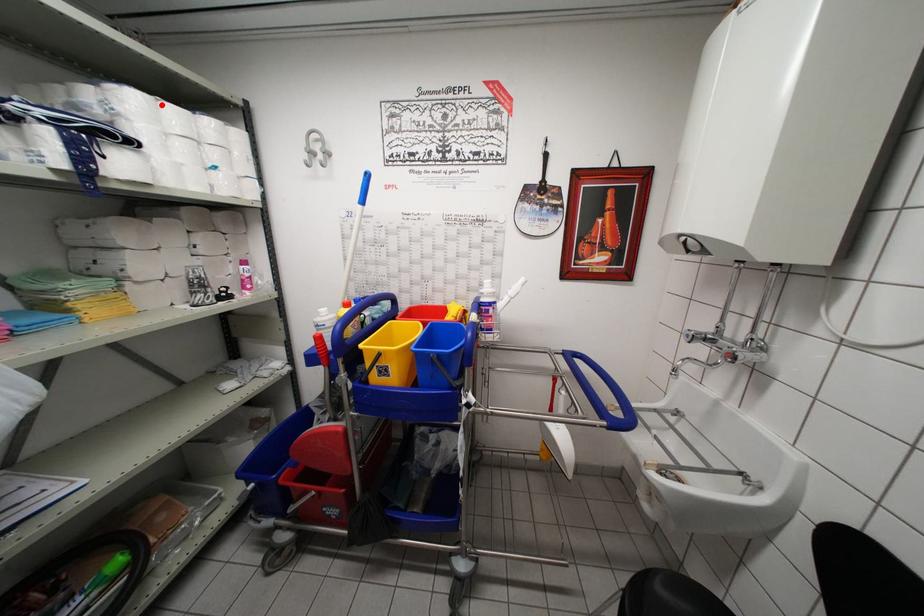
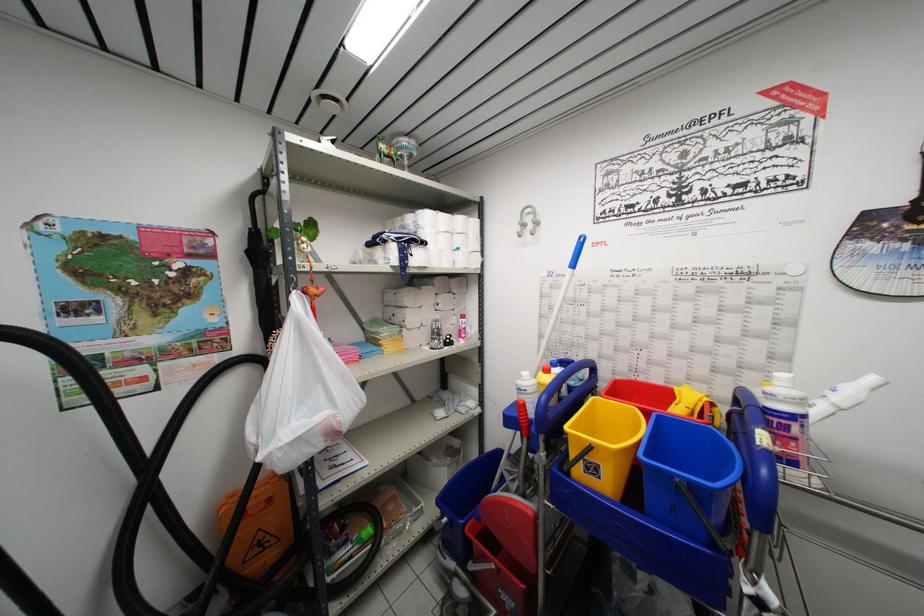
The point at the highlighted location is marked in the first image. Where is the corresponding point in the second image?

(441, 217)